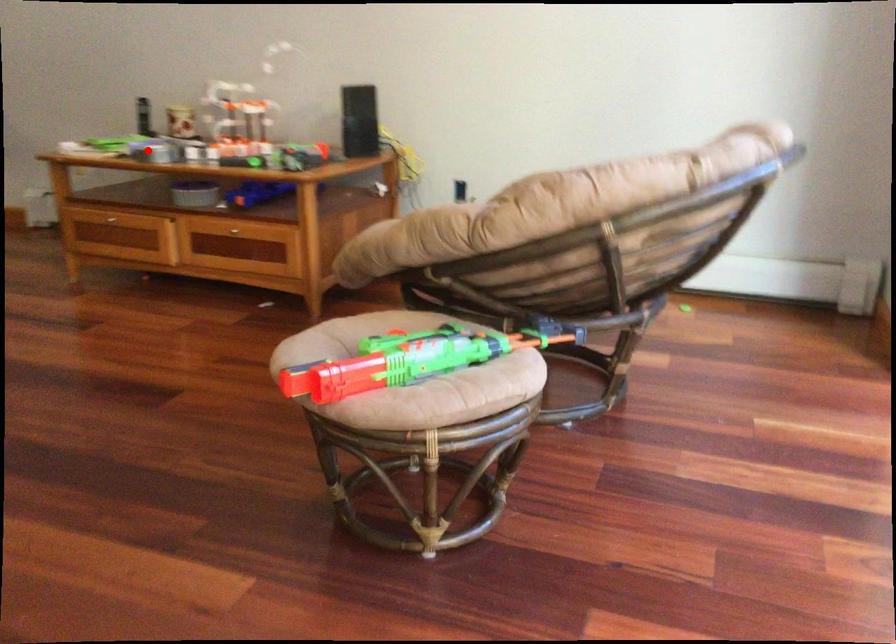
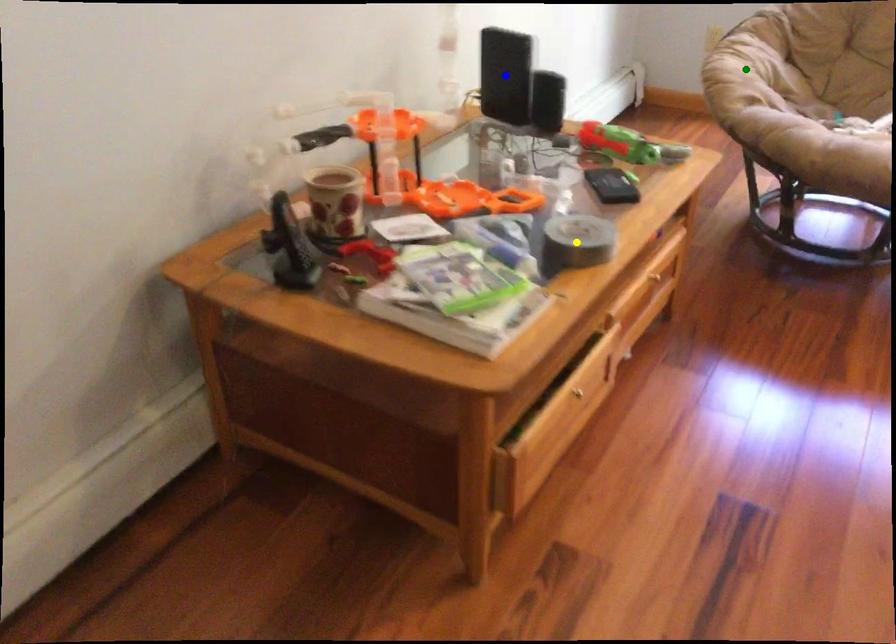
Question: I am providing you with two images of the same scene from different viewpoints. A red point is marked on the first image. You are given multiple points on the second image. In image 2, which mark is for the same physical point as the one in image 1?

Choices:
 (A) green point
 (B) yellow point
 (C) blue point

Answer: (B)